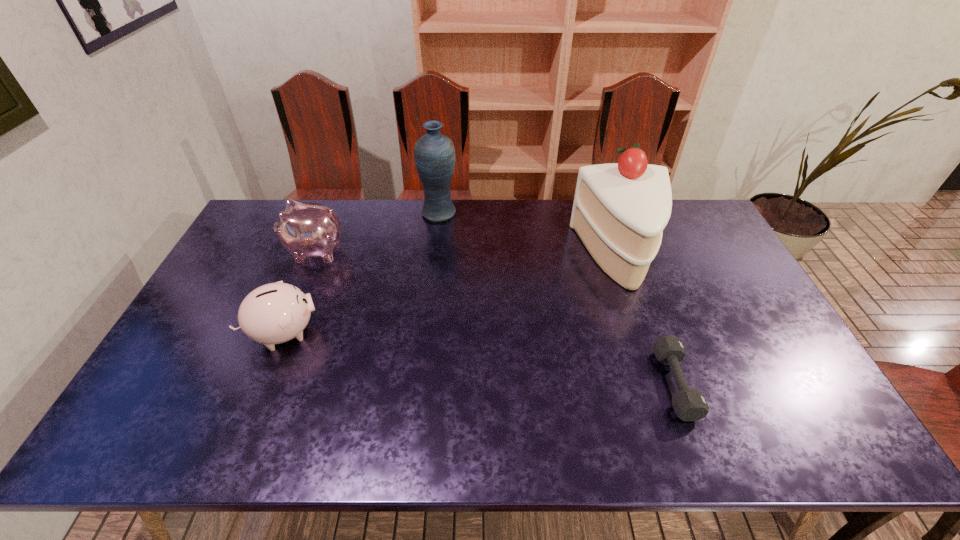
Image resolution: width=960 pixels, height=540 pixels. Find the location of `vacant region located on the front facing side of the farther piggy bank`. vacant region located on the front facing side of the farther piggy bank is located at coordinates (249, 251).

Where is `vacant region located 0.180m on the front of the nearer piggy bank`? The image size is (960, 540). vacant region located 0.180m on the front of the nearer piggy bank is located at coordinates (248, 422).

Where is `vacant region located 0.290m on the left of the shortest object`? Image resolution: width=960 pixels, height=540 pixels. vacant region located 0.290m on the left of the shortest object is located at coordinates (545, 384).

Find the location of a particular element. This screenshot has height=540, width=960. vase that is at the far edge is located at coordinates (434, 153).

The image size is (960, 540). In order to click on cake situated at the far edge in this screenshot , I will do `click(619, 212)`.

Image resolution: width=960 pixels, height=540 pixels. In order to click on piggy bank that is at the far edge in this screenshot , I will do `click(306, 230)`.

I want to click on object that is at the near edge, so click(689, 404).

Where is `vacant space at the far edge`? This screenshot has height=540, width=960. vacant space at the far edge is located at coordinates click(x=482, y=225).

Find the location of `vacant space at the near edge of the desktop`. vacant space at the near edge of the desktop is located at coordinates (525, 447).

This screenshot has height=540, width=960. In the image, there is a desktop. Identify the location of blank space at the left edge. (213, 295).